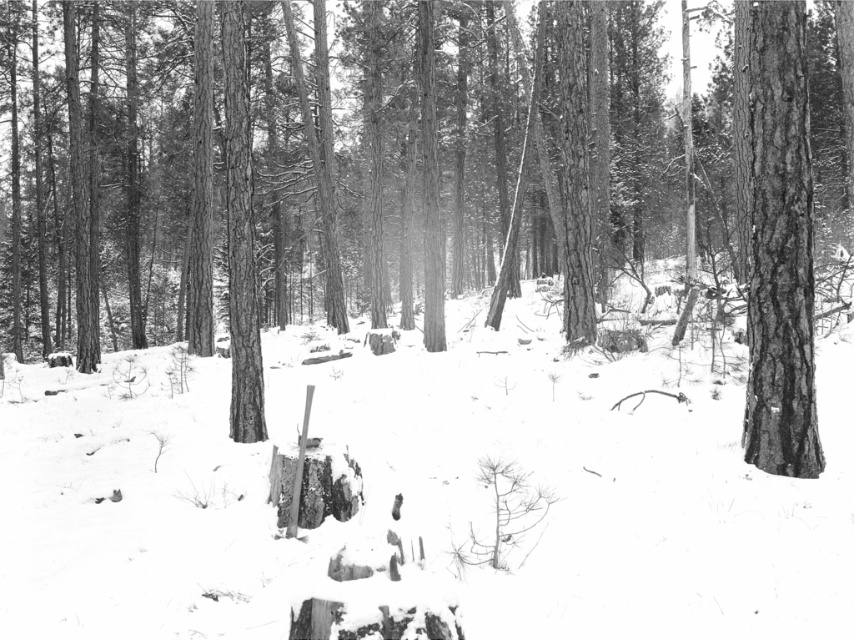
You are an observer standing in the winter forest scene. You notice the white powdery snow at center and the smooth bark tree at right. Which object appears taller in the image?

The smooth bark tree at right is taller than the white powdery snow at center.

You are standing in the winter forest and want to take a photo of both the rough bark tree at center and the smooth bark tree at right. Since you can only focus on one tree at a time, which tree should you focus on to ensure the other is still in the background?

You should focus on the rough bark tree at center because it is positioned over the smooth bark tree at right, meaning the smooth bark tree at right is behind and would remain in the background if the rough bark tree at center is in focus.